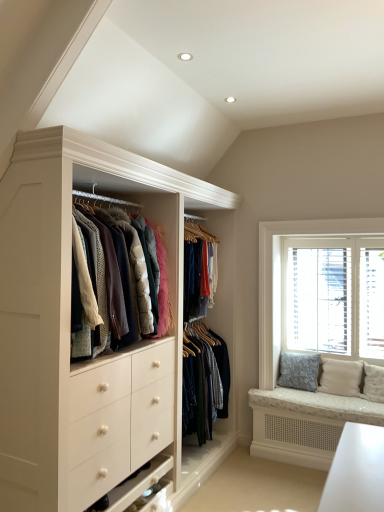
Where is `white wooden window at right`? The image size is (384, 512). white wooden window at right is located at coordinates (272, 271).

At what (x,y) coordinates should I click in order to perform the action: click on textured beige pillow at right, positioned as the 1th pillow in right-to-left order. Please return your answer as a coordinate pair (x, y). This screenshot has height=512, width=384. Looking at the image, I should click on (341, 377).

The height and width of the screenshot is (512, 384). What do you see at coordinates (341, 377) in the screenshot?
I see `textured beige pillow at right, which is counted as the second pillow, starting from the left` at bounding box center [341, 377].

The image size is (384, 512). I want to click on white wooden window at right, so click(x=272, y=271).

Is blue floral cushion at right, acting as the 2th pillow starting from the right, inside or outside of white wooden window at right?

blue floral cushion at right, acting as the 2th pillow starting from the right, is located beyond the bounds of white wooden window at right.

From the image's perspective, is blue floral cushion at right, which is the 1th pillow from left to right, above or below white wooden window at right?

Clearly, from the image's perspective, blue floral cushion at right, which is the 1th pillow from left to right, is below white wooden window at right.

Is blue floral cushion at right, which is the 1th pillow from left to right, to the right of white wooden window at right from the viewer's perspective?

In fact, blue floral cushion at right, which is the 1th pillow from left to right, is to the left of white wooden window at right.

From a real-world perspective, is blue floral cushion at right, acting as the 2th pillow starting from the right, on white wooden window at right?

Incorrect, from a real-world perspective, blue floral cushion at right, acting as the 2th pillow starting from the right, is lower than white wooden window at right.

Is white wooden window at right bigger or smaller than blue floral cushion at right, acting as the 2th pillow starting from the right?

Clearly, white wooden window at right is larger in size than blue floral cushion at right, acting as the 2th pillow starting from the right.

Which object is positioned more to the left, white wooden window at right or blue floral cushion at right, acting as the 2th pillow starting from the right?

blue floral cushion at right, acting as the 2th pillow starting from the right, is more to the left.

Is white wooden window at right thinner than blue floral cushion at right, which is the 1th pillow from left to right?

Indeed, white wooden window at right has a lesser width compared to blue floral cushion at right, which is the 1th pillow from left to right.

From a real-world perspective, who is located higher, white wooden window at right or blue floral cushion at right, acting as the 2th pillow starting from the right?

white wooden window at right.

Can you see blue floral cushion at right, acting as the 2th pillow starting from the right, touching textured beige pillow at right, which is counted as the second pillow, starting from the left?

No, blue floral cushion at right, acting as the 2th pillow starting from the right, is not beside textured beige pillow at right, which is counted as the second pillow, starting from the left.

Between blue floral cushion at right, acting as the 2th pillow starting from the right, and textured beige pillow at right, which is counted as the second pillow, starting from the left, which one has smaller width?

With smaller width is textured beige pillow at right, which is counted as the second pillow, starting from the left.

Which object is further away from the camera taking this photo, blue floral cushion at right, which is the 1th pillow from left to right, or textured beige pillow at right, positioned as the 1th pillow in right-to-left order?

Positioned behind is blue floral cushion at right, which is the 1th pillow from left to right.

Is blue floral cushion at right, which is the 1th pillow from left to right, looking in the opposite direction of textured beige pillow at right, which is counted as the second pillow, starting from the left?

No.

Between textured beige pillow at right, positioned as the 1th pillow in right-to-left order, and blue floral cushion at right, acting as the 2th pillow starting from the right, which one has smaller size?

With smaller size is textured beige pillow at right, positioned as the 1th pillow in right-to-left order.

Is blue floral cushion at right, acting as the 2th pillow starting from the right, at the back of textured beige pillow at right, positioned as the 1th pillow in right-to-left order?

textured beige pillow at right, positioned as the 1th pillow in right-to-left order, does not have its back to blue floral cushion at right, acting as the 2th pillow starting from the right.

Locate an element on the screen. pillow in front of the blue floral cushion at right, acting as the 2th pillow starting from the right is located at coordinates (341, 377).

In terms of height, does textured beige pillow at right, positioned as the 1th pillow in right-to-left order, look taller or shorter compared to blue floral cushion at right, which is the 1th pillow from left to right?

In the image, textured beige pillow at right, positioned as the 1th pillow in right-to-left order, appears to be shorter than blue floral cushion at right, which is the 1th pillow from left to right.

Could you tell me if textured beige pillow at right, positioned as the 1th pillow in right-to-left order, is facing white wooden window at right?

No, textured beige pillow at right, positioned as the 1th pillow in right-to-left order, is not turned towards white wooden window at right.

Is textured beige pillow at right, which is counted as the second pillow, starting from the left, not inside white wooden window at right?

Yes, textured beige pillow at right, which is counted as the second pillow, starting from the left, is located beyond the bounds of white wooden window at right.

Measure the distance from textured beige pillow at right, positioned as the 1th pillow in right-to-left order, to white wooden window at right.

textured beige pillow at right, positioned as the 1th pillow in right-to-left order, and white wooden window at right are 30.24 inches apart from each other.

Considering the sizes of objects textured beige pillow at right, which is counted as the second pillow, starting from the left, and white wooden window at right in the image provided, who is thinner, textured beige pillow at right, which is counted as the second pillow, starting from the left, or white wooden window at right?

Thinner between the two is white wooden window at right.

From the image's perspective, count 2nd pillows downward from the white wooden window at right and point to it. Please provide its 2D coordinates.

[(341, 377)]

Based on the photo, is white wooden window at right wider or thinner than textured beige pillow at right, which is counted as the second pillow, starting from the left?

Clearly, white wooden window at right has less width compared to textured beige pillow at right, which is counted as the second pillow, starting from the left.

Is white wooden window at right with textured beige pillow at right, which is counted as the second pillow, starting from the left?

No, white wooden window at right is not next to textured beige pillow at right, which is counted as the second pillow, starting from the left.

Considering their positions, is white wooden window at right located in front of or behind textured beige pillow at right, positioned as the 1th pillow in right-to-left order?

In the image, white wooden window at right appears behind textured beige pillow at right, positioned as the 1th pillow in right-to-left order.

Find the location of a particular element. This screenshot has height=512, width=384. window in front of the blue floral cushion at right, acting as the 2th pillow starting from the right is located at coordinates (272, 271).

This screenshot has height=512, width=384. In order to click on pillow on the left side of white wooden window at right in this screenshot , I will do `click(299, 371)`.

Which object lies nearer to the anchor point blue floral cushion at right, acting as the 2th pillow starting from the right, textured beige pillow at right, which is counted as the second pillow, starting from the left, or white wooden window at right?

textured beige pillow at right, which is counted as the second pillow, starting from the left, lies closer to blue floral cushion at right, acting as the 2th pillow starting from the right, than the other object.

Based on their spatial positions, is white wooden window at right or textured beige pillow at right, which is counted as the second pillow, starting from the left, closer to blue floral cushion at right, which is the 1th pillow from left to right?

Among the two, textured beige pillow at right, which is counted as the second pillow, starting from the left, is located nearer to blue floral cushion at right, which is the 1th pillow from left to right.

From the image, which object appears to be farther from textured beige pillow at right, positioned as the 1th pillow in right-to-left order, white wooden window at right or blue floral cushion at right, acting as the 2th pillow starting from the right?

white wooden window at right is positioned further to the anchor textured beige pillow at right, positioned as the 1th pillow in right-to-left order.

Which object lies nearer to the anchor point white wooden window at right, textured beige pillow at right, which is counted as the second pillow, starting from the left, or blue floral cushion at right, which is the 1th pillow from left to right?

blue floral cushion at right, which is the 1th pillow from left to right, is positioned closer to the anchor white wooden window at right.

When comparing their distances from textured beige pillow at right, which is counted as the second pillow, starting from the left, does blue floral cushion at right, which is the 1th pillow from left to right, or white wooden window at right seem further?

white wooden window at right lies further to textured beige pillow at right, which is counted as the second pillow, starting from the left, than the other object.

Considering their positions, is blue floral cushion at right, which is the 1th pillow from left to right, positioned further to white wooden window at right than textured beige pillow at right, which is counted as the second pillow, starting from the left?

textured beige pillow at right, which is counted as the second pillow, starting from the left, is positioned further to the anchor white wooden window at right.

Find the location of a particular element. This screenshot has width=384, height=512. pillow between white wooden window at right and textured beige pillow at right, which is counted as the second pillow, starting from the left, vertically is located at coordinates click(x=299, y=371).